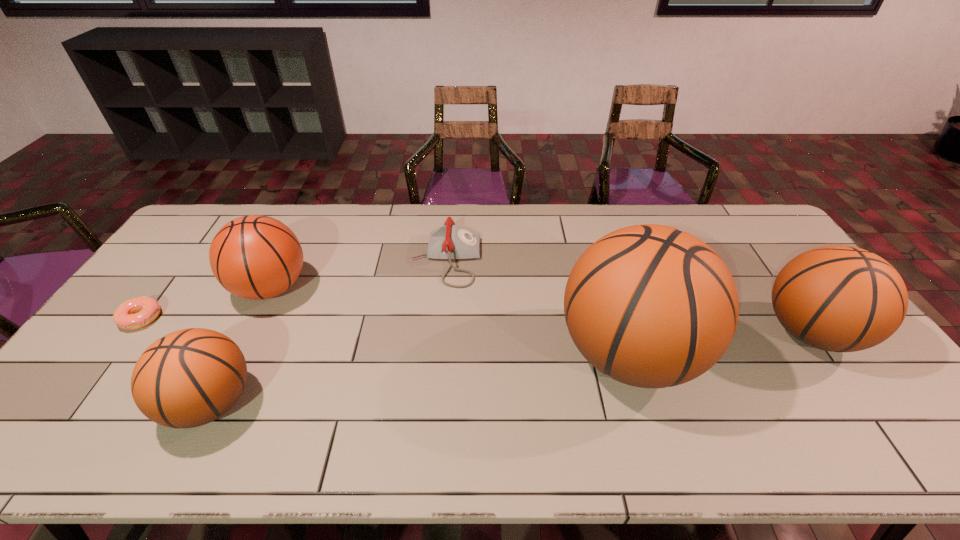
To achieve uniform spacing by inserting another basketball among them, please point to a free space for this new basketball. Please provide its 2D coordinates. Your answer should be formatted as a tuple, i.e. [(x, y)], where the tuple contains the x and y coordinates of a point satisfying the conditions above.

[(430, 377)]